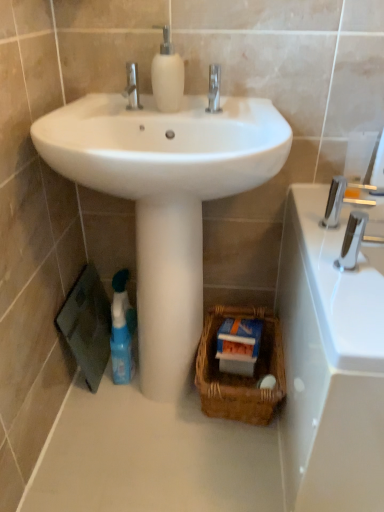
Question: From a real-world perspective, is silver metallic faucet at upper right positioned above or below blue glossy bottle at lower left?

Choices:
 (A) below
 (B) above

Answer: (B)

Question: In the image, is silver metallic faucet at upper right positioned in front of or behind blue glossy bottle at lower left?

Choices:
 (A) front
 (B) behind

Answer: (A)

Question: Estimate the real-world distances between objects in this image. Which object is farther from the blue glossy bottle at lower left?

Choices:
 (A) brown woven basket at lower center
 (B) white smooth pedestal at center
 (C) white glossy sink at center
 (D) white glossy soap dispenser at center
 (E) silver metallic faucet at upper right

Answer: (E)

Question: Which object is the farthest from the polished chrome tap at right?

Choices:
 (A) brown woven basket at lower center
 (B) white smooth pedestal at center
 (C) silver metallic faucet at upper right
 (D) white glossy sink at center
 (E) white glossy soap dispenser at center

Answer: (E)